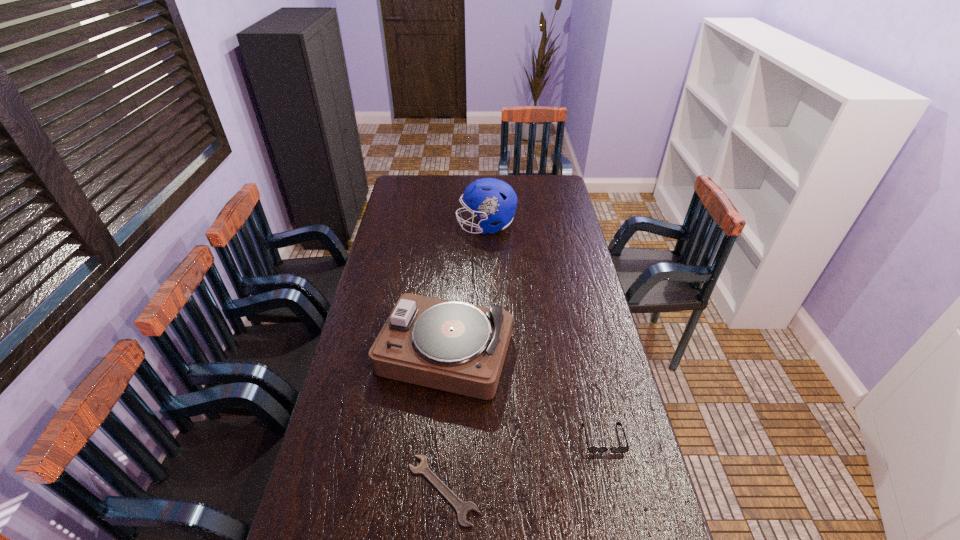
You are a GUI agent. You are given a task and a screenshot of the screen. Output one action in this format:
    pyautogui.click(x=<x>, y=<y>)
    Task: Click on the unoccupied area between the record player and the wrench
    This screenshot has width=960, height=540.
    Given the screenshot: What is the action you would take?
    pyautogui.click(x=443, y=421)

Where is `vacant area that lies between the rightmost object and the nearest object`? Image resolution: width=960 pixels, height=540 pixels. vacant area that lies between the rightmost object and the nearest object is located at coordinates (523, 464).

You are a GUI agent. You are given a task and a screenshot of the screen. Output one action in this format:
    pyautogui.click(x=<x>, y=<y>)
    Task: Click on the free area in between the rightmost object and the shortest object
    
    Given the screenshot: What is the action you would take?
    [x=523, y=464]

Where is `unoccupied area between the record player and the nearest object`? This screenshot has height=540, width=960. unoccupied area between the record player and the nearest object is located at coordinates (443, 421).

The image size is (960, 540). I want to click on free area in between the farthest object and the sunglasses, so pyautogui.click(x=544, y=332).

Locate an element on the screen. vacant area between the nearest object and the third nearest object is located at coordinates (443, 421).

Locate an element on the screen. empty space that is in between the third shortest object and the shortest object is located at coordinates (443, 421).

I want to click on free spot between the second nearest object and the farthest object, so click(x=544, y=332).

Locate an element on the screen. The height and width of the screenshot is (540, 960). free spot between the shortest object and the third shortest object is located at coordinates (443, 421).

I want to click on object that stands as the second closest to the third nearest object, so click(591, 449).